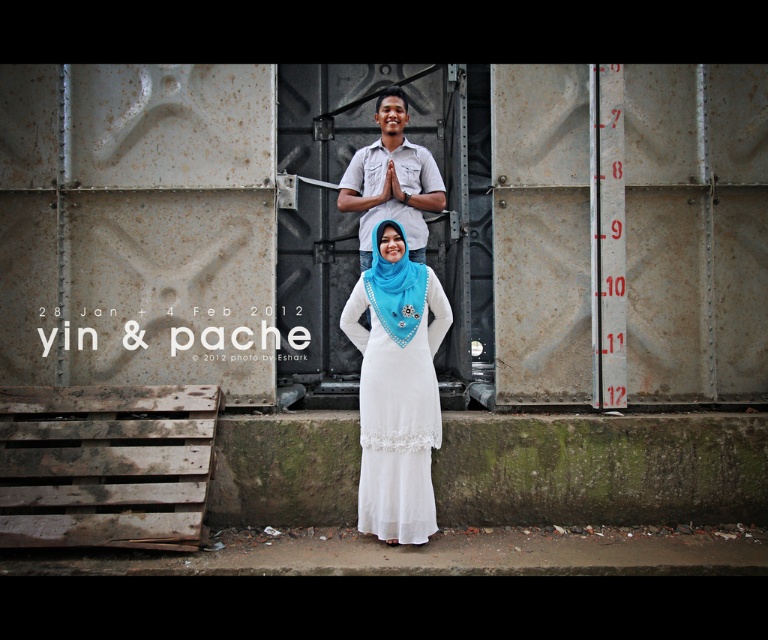
Is matte white shirt at center taller than blue satin headscarf at center?

Indeed, matte white shirt at center has a greater height compared to blue satin headscarf at center.

Where is `matte white shirt at center`? The width and height of the screenshot is (768, 640). matte white shirt at center is located at coordinates (391, 180).

Between white sheer dress at center and blue satin headscarf at center, which one is positioned higher?

blue satin headscarf at center

Is white sheer dress at center above blue satin headscarf at center?

No.

You are a GUI agent. You are given a task and a screenshot of the screen. Output one action in this format:
    pyautogui.click(x=<x>, y=<y>)
    Task: Click on the white sheer dress at center
    Image resolution: width=768 pixels, height=640 pixels.
    Given the screenshot: What is the action you would take?
    pyautogui.click(x=396, y=416)

The height and width of the screenshot is (640, 768). What are the coordinates of `white sheer dress at center` in the screenshot? It's located at (396, 416).

Does point (392, 410) come in front of point (399, 189)?

Yes.

The image size is (768, 640). Describe the element at coordinates (396, 416) in the screenshot. I see `white sheer dress at center` at that location.

What are the coordinates of `white sheer dress at center` in the screenshot? It's located at (396, 416).